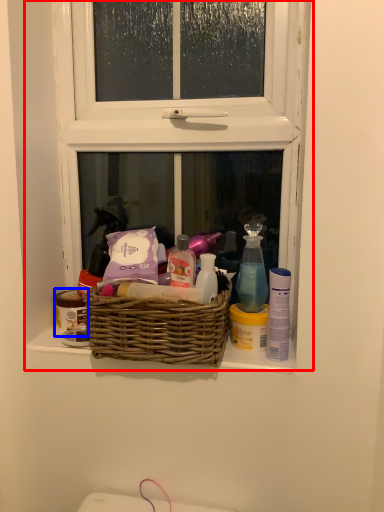
Question: Which of the following is the farthest to the observer, window (highlighted by a red box) or toiletry (highlighted by a blue box)?

Choices:
 (A) window
 (B) toiletry

Answer: (B)